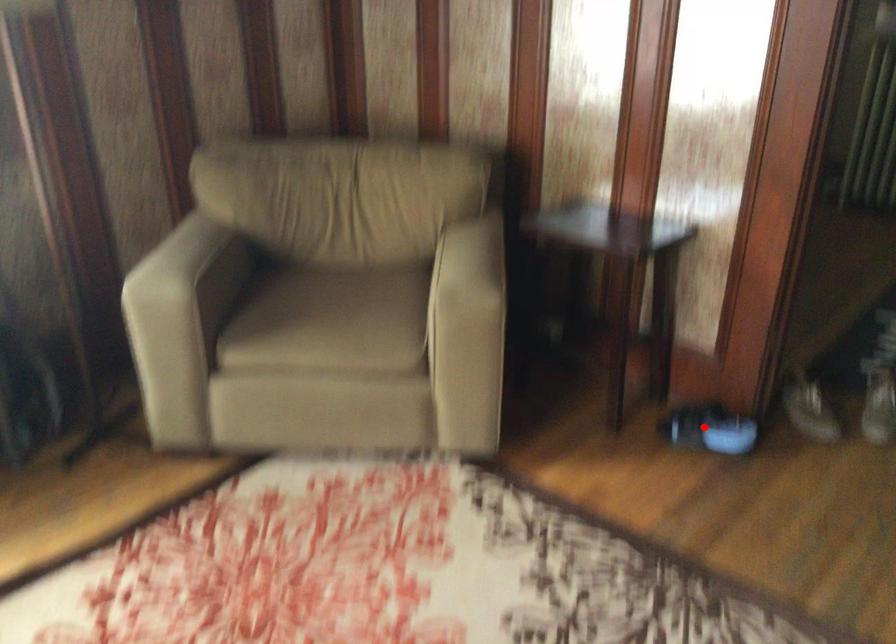
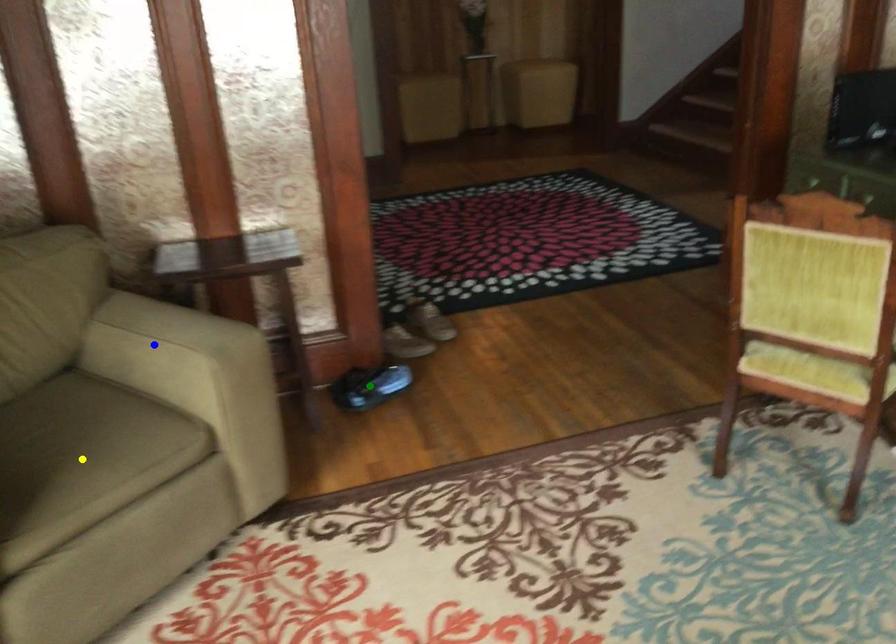
Question: I am providing you with two images of the same scene from different viewpoints. A red point is marked on the first image. You are given multiple points on the second image. Which mark in image 2 goes with the point in image 1?

Choices:
 (A) green point
 (B) yellow point
 (C) blue point

Answer: (A)